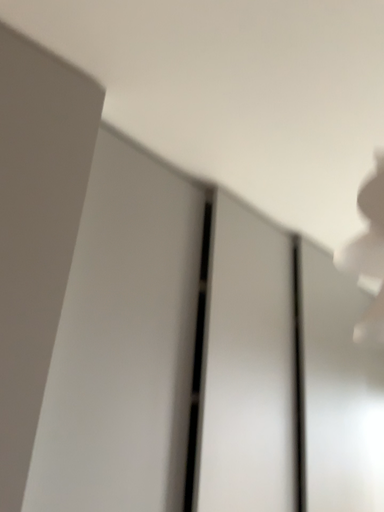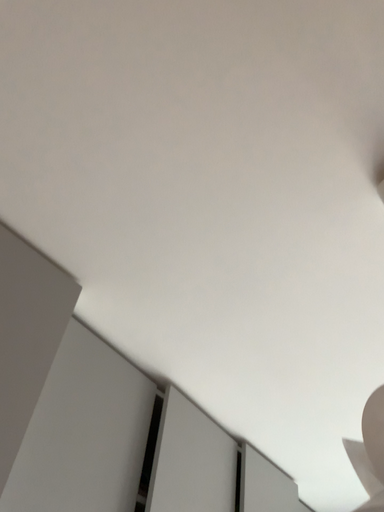
Question: Which way did the camera rotate in the video?

Choices:
 (A) rotated left
 (B) rotated right

Answer: (B)